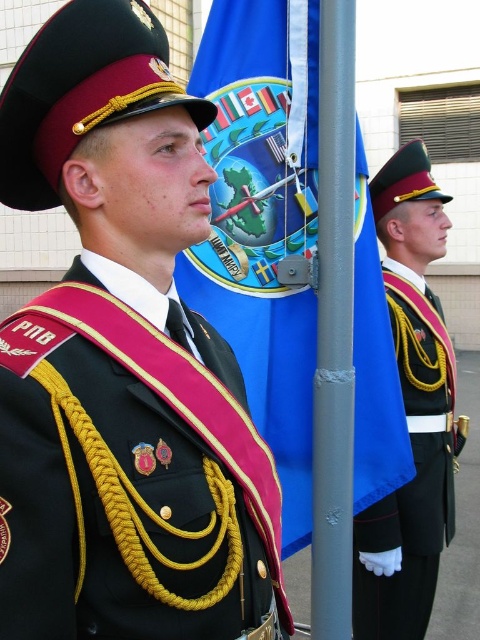
Who is shorter, gray metallic pole at center or shiny black uniform at right?

With less height is shiny black uniform at right.

Is gray metallic pole at center to the left of shiny black uniform at right from the viewer's perspective?

Correct, you'll find gray metallic pole at center to the left of shiny black uniform at right.

Which is in front, point (324, 460) or point (355, 522)?

Point (324, 460) is in front.

Locate an element on the screen. The height and width of the screenshot is (640, 480). gray metallic pole at center is located at coordinates (334, 328).

Is black satin sash at center shorter than shiny black uniform at right?

Correct, black satin sash at center is not as tall as shiny black uniform at right.

Is black satin sash at center closer to the viewer compared to shiny black uniform at right?

Yes, it is in front of shiny black uniform at right.

Which is behind, point (177, 621) or point (447, 502)?

The point (447, 502) is behind.

Where is `black satin sash at center`? black satin sash at center is located at coordinates (129, 477).

Between black satin sash at center and gray metallic pole at center, which one has more height?

gray metallic pole at center is taller.

Between point (60, 352) and point (346, 8), which one is positioned in front?

Positioned in front is point (60, 352).

Who is more forward, (x=69, y=468) or (x=334, y=96)?

Point (x=69, y=468)

The width and height of the screenshot is (480, 640). I want to click on black satin sash at center, so click(129, 477).